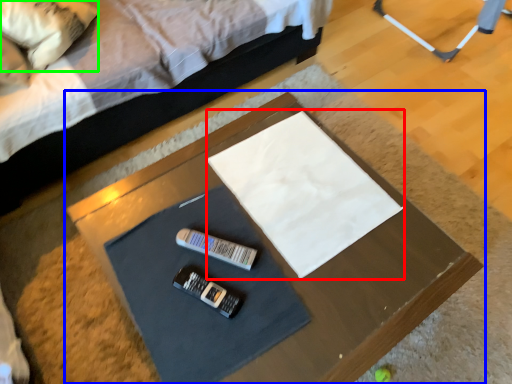
Question: Which object is positioned closest to linen (highlighted by a red box)? Select from table (highlighted by a blue box) and pillow (highlighted by a green box).

Choices:
 (A) table
 (B) pillow

Answer: (A)